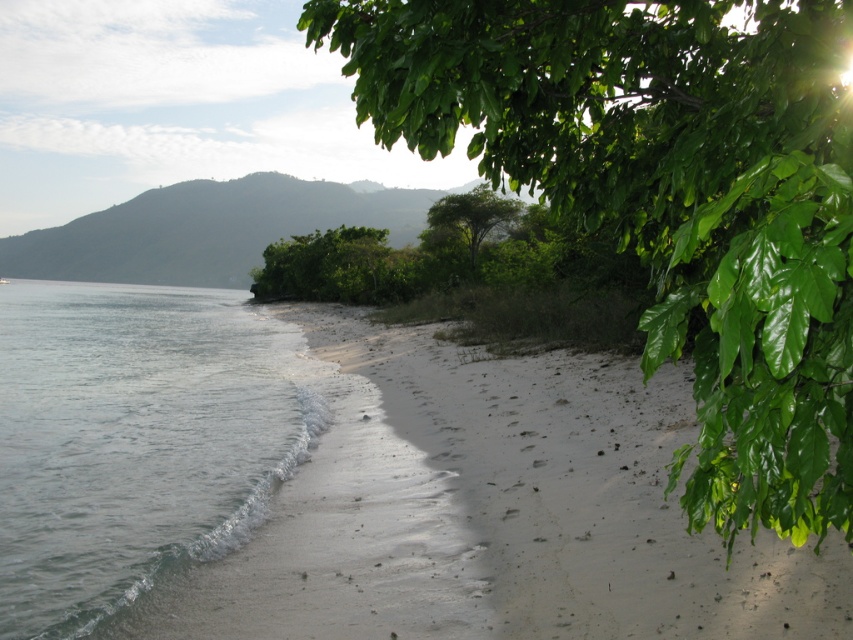
Who is positioned more to the right, green leafy tree at upper right or sandy beach at lower left?

sandy beach at lower left is more to the right.

Measure the distance between point [784,184] and camera.

They are 4.63 feet apart.

At what (x,y) coordinates should I click in order to perform the action: click on green leafy tree at upper right. Please return your answer as a coordinate pair (x, y). This screenshot has width=853, height=640. Looking at the image, I should click on (666, 196).

Consider the image. Is sandy beach at lower left wider than clear water at lower left?

No.

Who is lower down, sandy beach at lower left or clear water at lower left?

sandy beach at lower left is below.

Which is in front, point (305, 500) or point (45, 472)?

Positioned in front is point (305, 500).

You are a GUI agent. You are given a task and a screenshot of the screen. Output one action in this format:
    pyautogui.click(x=<x>, y=<y>)
    Task: Click on the sandy beach at lower left
    This screenshot has width=853, height=640.
    Given the screenshot: What is the action you would take?
    pyautogui.click(x=492, y=512)

Does green leafy tree at upper right appear under green leafy tree at center?

Indeed, green leafy tree at upper right is positioned under green leafy tree at center.

Is point (717, 58) in front of point (512, 208)?

Yes, it is in front of point (512, 208).

Where is `green leafy tree at upper right`? green leafy tree at upper right is located at coordinates (666, 196).